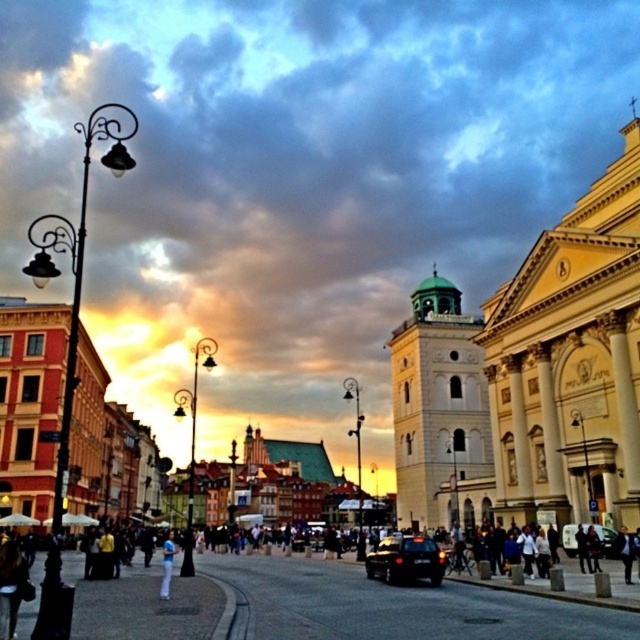
Does black matte car at lower center have a lesser width compared to white cotton pants at lower center?

Correct, black matte car at lower center's width is less than white cotton pants at lower center's.

What do you see at coordinates (404, 560) in the screenshot? I see `black matte car at lower center` at bounding box center [404, 560].

The width and height of the screenshot is (640, 640). Identify the location of black matte car at lower center. click(x=404, y=560).

Between black matte car at lower center and shiny black car at center, which one is positioned higher?

shiny black car at center

Between black matte car at lower center and shiny black car at center, which one appears on the right side from the viewer's perspective?

From the viewer's perspective, shiny black car at center appears more on the right side.

Between point (426, 577) and point (566, 552), which one is positioned behind?

The point (566, 552) is more distant.

This screenshot has width=640, height=640. Identify the location of black matte car at lower center. (404, 560).

Which of these two, shiny black car at center or white cotton pants at lower center, stands taller?

With more height is white cotton pants at lower center.

The height and width of the screenshot is (640, 640). In order to click on shiny black car at center in this screenshot , I will do `click(605, 540)`.

Identify the location of shiny black car at center. 605,540.